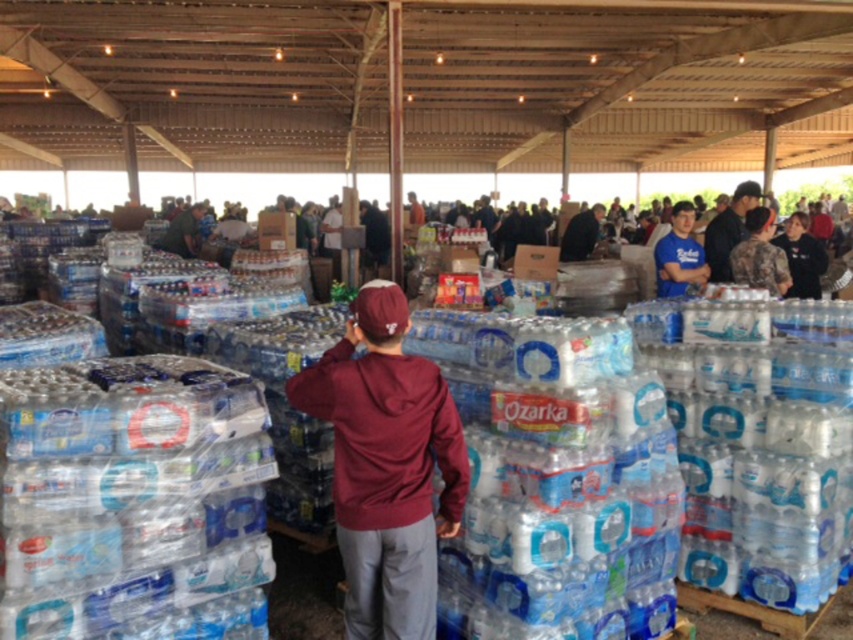
Is camouflage uniform at right bigger than blue cotton shirt at upper right?

No.

Between point (738, 243) and point (694, 269), which one is positioned behind?

The point (738, 243) is behind.

Does point (729, 260) lie in front of point (677, 227)?

Yes, point (729, 260) is closer to viewer.

Where is `camouflage uniform at right`? This screenshot has width=853, height=640. camouflage uniform at right is located at coordinates (759, 253).

In the scene shown: Who is more forward, (413,484) or (668,278)?

Point (413,484) is more forward.

Which is more to the right, maroon hoodie at center or blue cotton shirt at upper right?

From the viewer's perspective, blue cotton shirt at upper right appears more on the right side.

What do you see at coordinates (386, 465) in the screenshot? The height and width of the screenshot is (640, 853). I see `maroon hoodie at center` at bounding box center [386, 465].

Find the location of `maroon hoodie at center`. maroon hoodie at center is located at coordinates (386, 465).

Does maroon hoodie at center have a larger size compared to camouflage uniform at right?

Correct, maroon hoodie at center is larger in size than camouflage uniform at right.

Who is lower down, maroon hoodie at center or camouflage uniform at right?

maroon hoodie at center is lower down.

Locate an element on the screen. The height and width of the screenshot is (640, 853). maroon hoodie at center is located at coordinates click(386, 465).

Image resolution: width=853 pixels, height=640 pixels. Identify the location of maroon hoodie at center. (386, 465).